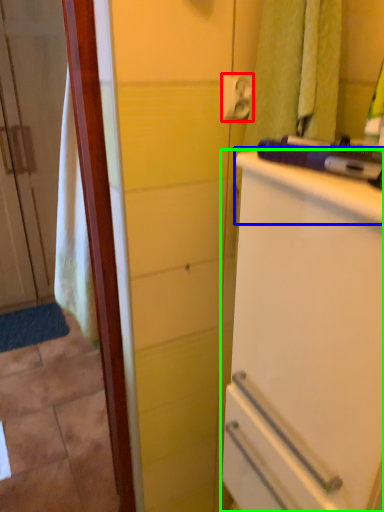
Question: Which object is the farthest from towel bar (highlighted by a red box)? Choose among these: counter top (highlighted by a blue box) or refrigerator (highlighted by a green box).

Choices:
 (A) counter top
 (B) refrigerator

Answer: (B)